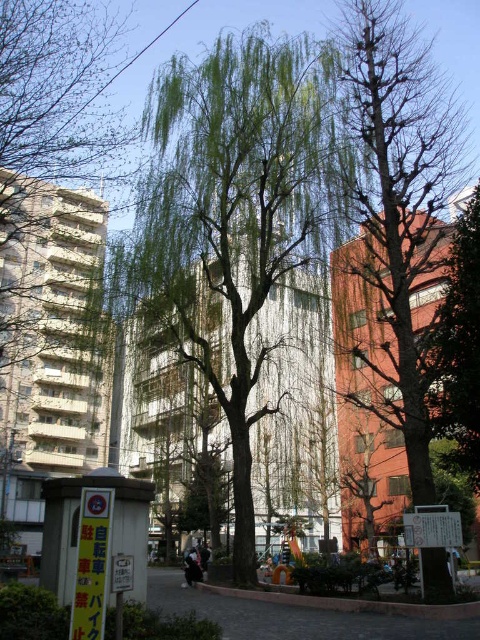
Question: Among these points, which one is nearest to the camera?

Choices:
 (A) tap(424, 556)
 (B) tap(289, 180)
 (C) tap(464, 218)

Answer: (A)

Question: Is green leafy willow at center to the left of bare branches at right from the viewer's perspective?

Choices:
 (A) yes
 (B) no

Answer: (A)

Question: From the image, what is the correct spatial relationship of bare branches tree at right in relation to bare branches at right?

Choices:
 (A) right
 (B) left

Answer: (B)

Question: Which of the following is the closest to the observer?

Choices:
 (A) (429, 346)
 (B) (153, 260)

Answer: (A)

Question: Which object appears closest to the camera in this image?

Choices:
 (A) green leafy willow at center
 (B) bare branches tree at right

Answer: (B)

Question: Considering the relative positions of green leafy willow at center and bare branches at right in the image provided, where is green leafy willow at center located with respect to bare branches at right?

Choices:
 (A) below
 (B) above

Answer: (B)